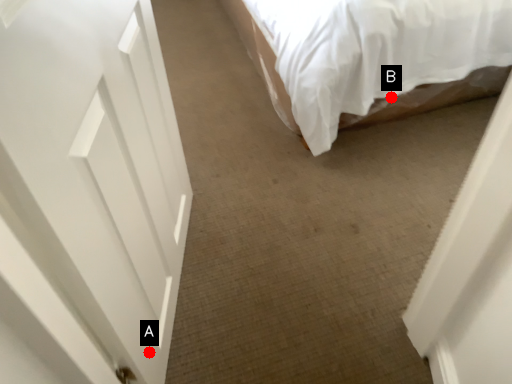
Question: Two points are circled on the image, labeled by A and B beside each circle. Which point appears closest to the camera in this image?

Choices:
 (A) A is closer
 (B) B is closer

Answer: (A)